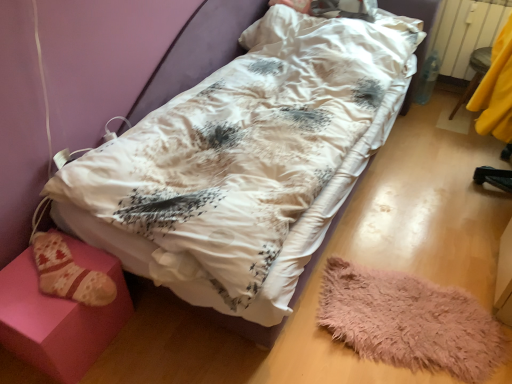
You are a GUI agent. You are given a task and a screenshot of the screen. Output one action in this format:
    pyautogui.click(x=<x>, y=<y>)
    Task: Click on the free space above pink fabric stool at lower left, the first furniture ordered from the bottom (from a real-world perspective)
    The width and height of the screenshot is (512, 384).
    Given the screenshot: What is the action you would take?
    pyautogui.click(x=42, y=278)